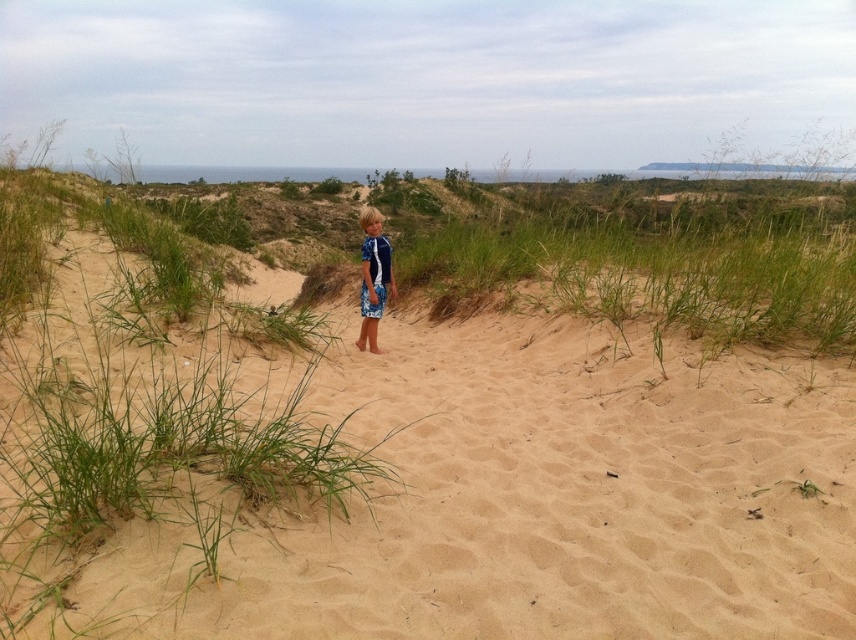
You are a photographer trying to capture the child in the scene. Since the sandy tan sand at center and the blue printed rash guard at center are both visible, which one appears taller in the photo?

The blue printed rash guard at center appears taller than the sandy tan sand at center because the sandy tan sand at center is shorter than the blue printed rash guard at center.

You are a photographer trying to capture the child in the image. You want to ensure the blue printed rash guard at center is visible in the frame. Given the sandy tan sand at center is to the left of the rash guard, where should you position the camera relative to the child?

Since the sandy tan sand at center is to the left of the blue printed rash guard at center, you should position the camera to the left side of the child to ensure the rash guard remains visible and centered in the frame while the sand appears on its left side.

You are a photographer planning to take a photo of the sandy tan sand at center and the blue printed rash guard at center in the coastal scene. You want to ensure both elements are in focus. Given that your camera has a depth of field that can cover up to 15 feet, will you be able to capture both objects clearly in the same shot?

The sandy tan sand at center and blue printed rash guard at center are 14.24 feet apart. Since the distance between them is within the camera lens depth of field of 15 feet, both objects can be captured clearly in focus in the same shot.